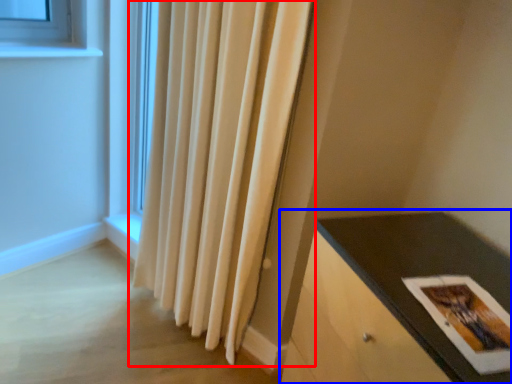
Question: Which object appears farthest to the camera in this image, curtain (highlighted by a red box) or table (highlighted by a blue box)?

Choices:
 (A) curtain
 (B) table

Answer: (A)